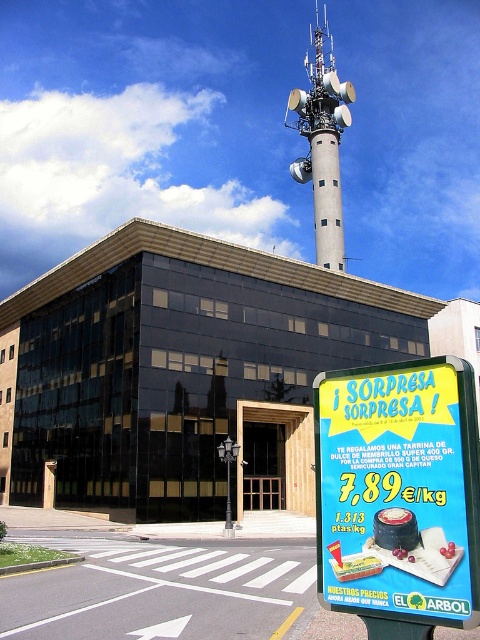
You are a city planner checking the street layout. You notice the metallic streetlight at center and the metallic pole at center. Which one is placed above the other?

The metallic streetlight at center is positioned over the metallic pole at center.

From the picture: You are a pedestrian standing at the crosswalk and see the yellow paper sign at lower right and the metallic streetlight at center. Which object is closer to your right side?

The yellow paper sign at lower right is to the right of the metallic streetlight at center, so it is closer to your right side.